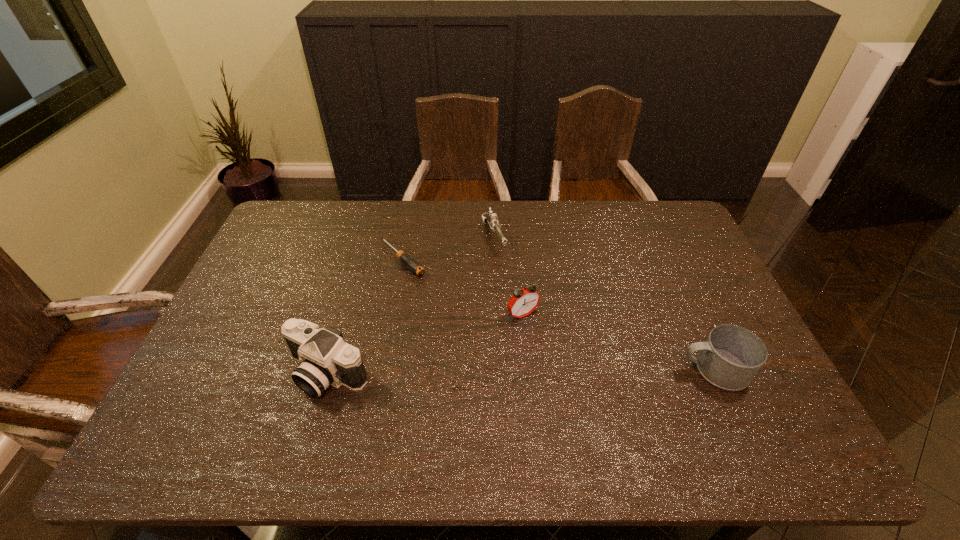
Where is `vacant spot on the desktop that is between the tallest object and the rightmost object and is positioned at the tip of the screwdriver`? vacant spot on the desktop that is between the tallest object and the rightmost object and is positioned at the tip of the screwdriver is located at coordinates (529, 372).

Where is `vacant spot on the desktop that is between the tallest object and the rightmost object and is positioned on the clock face of the alarm clock`? Image resolution: width=960 pixels, height=540 pixels. vacant spot on the desktop that is between the tallest object and the rightmost object and is positioned on the clock face of the alarm clock is located at coordinates (564, 371).

Find the location of `vacant space on the desktop that is between the tallest object and the rightmost object and is positioned aimed along the barrel of the gun`. vacant space on the desktop that is between the tallest object and the rightmost object and is positioned aimed along the barrel of the gun is located at coordinates (562, 371).